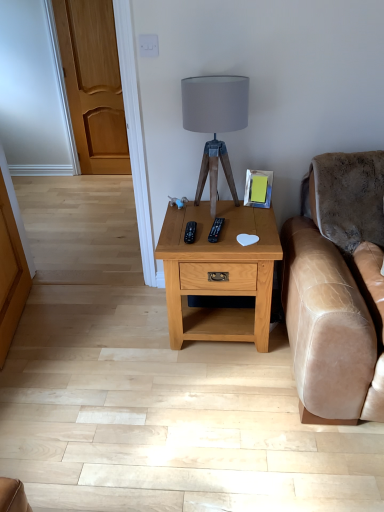
Question: From the image's perspective, does light brown wood nightstand at center appear higher than matte gray fabric lampshade at center?

Choices:
 (A) no
 (B) yes

Answer: (A)

Question: Does light brown wood nightstand at center appear on the right side of matte gray fabric lampshade at center?

Choices:
 (A) yes
 (B) no

Answer: (A)

Question: Does light brown wood nightstand at center have a lesser width compared to matte gray fabric lampshade at center?

Choices:
 (A) yes
 (B) no

Answer: (B)

Question: Is the position of light brown wood nightstand at center more distant than that of matte gray fabric lampshade at center?

Choices:
 (A) yes
 (B) no

Answer: (A)

Question: Is light brown wood nightstand at center oriented towards matte gray fabric lampshade at center?

Choices:
 (A) no
 (B) yes

Answer: (A)

Question: Is black plastic remote at center, the 1th remote in the right-to-left sequence, bigger or smaller than light brown wood nightstand at center?

Choices:
 (A) big
 (B) small

Answer: (B)

Question: From the image's perspective, is black plastic remote at center, the 1th remote in the right-to-left sequence, located above or below light brown wood nightstand at center?

Choices:
 (A) below
 (B) above

Answer: (B)

Question: Choose the correct answer: Is black plastic remote at center, the 2th remote from the left, inside light brown wood nightstand at center or outside it?

Choices:
 (A) inside
 (B) outside

Answer: (A)

Question: In terms of height, does black plastic remote at center, the 1th remote in the right-to-left sequence, look taller or shorter compared to light brown wood nightstand at center?

Choices:
 (A) short
 (B) tall

Answer: (A)

Question: Relative to light brown wood nightstand at center, is black plastic remote at center, acting as the first remote starting from the left, in front or behind?

Choices:
 (A) front
 (B) behind

Answer: (B)

Question: From the image's perspective, relative to light brown wood nightstand at center, is black plastic remote at center, which is counted as the second remote, starting from the right, above or below?

Choices:
 (A) below
 (B) above

Answer: (B)

Question: From a real-world perspective, is black plastic remote at center, acting as the first remote starting from the left, above or below light brown wood nightstand at center?

Choices:
 (A) below
 (B) above

Answer: (B)

Question: In terms of size, does black plastic remote at center, acting as the first remote starting from the left, appear bigger or smaller than light brown wood nightstand at center?

Choices:
 (A) big
 (B) small

Answer: (B)

Question: From the image's perspective, relative to black plastic remote at center, acting as the first remote starting from the left, is black plastic remote at center, the 2th remote from the left, above or below?

Choices:
 (A) below
 (B) above

Answer: (B)

Question: Considering the positions of black plastic remote at center, the 1th remote in the right-to-left sequence, and black plastic remote at center, which is counted as the second remote, starting from the right, in the image, is black plastic remote at center, the 1th remote in the right-to-left sequence, wider or thinner than black plastic remote at center, which is counted as the second remote, starting from the right,?

Choices:
 (A) thin
 (B) wide

Answer: (B)